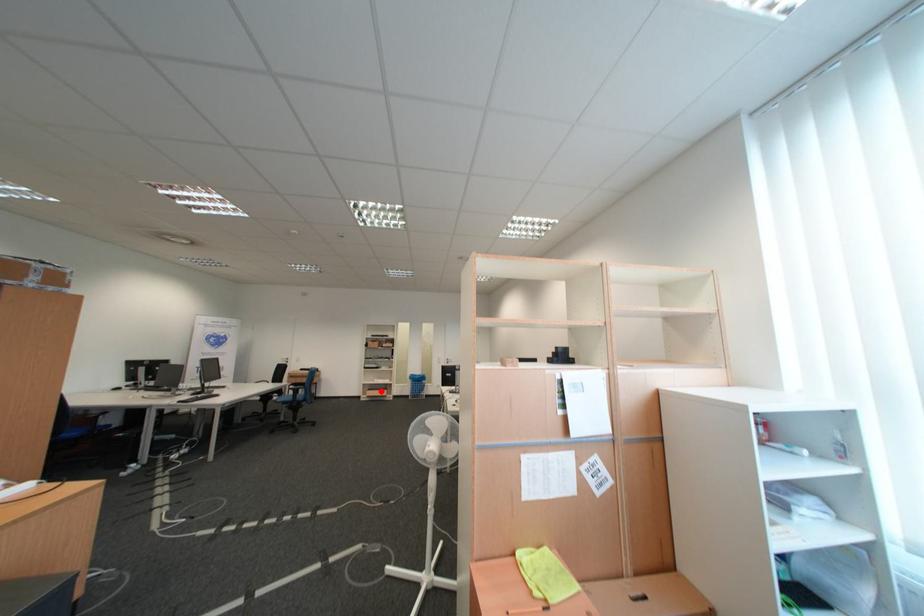
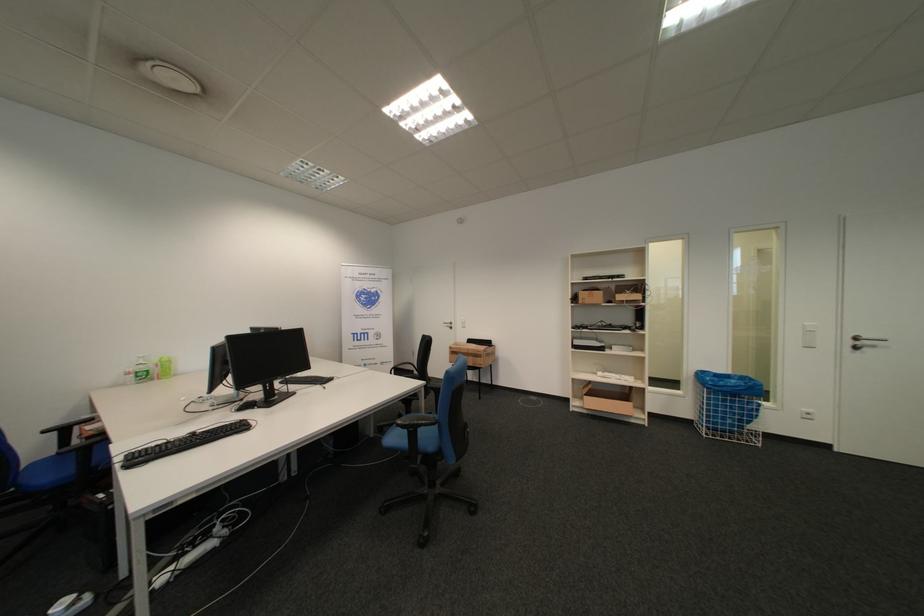
Question: I am providing you with two images of the same scene from different viewpoints. Given a red point in image1, look at the same physical point in image2. Is it:

Choices:
 (A) Closer to the viewpoint
 (B) Farther from the viewpoint

Answer: (A)